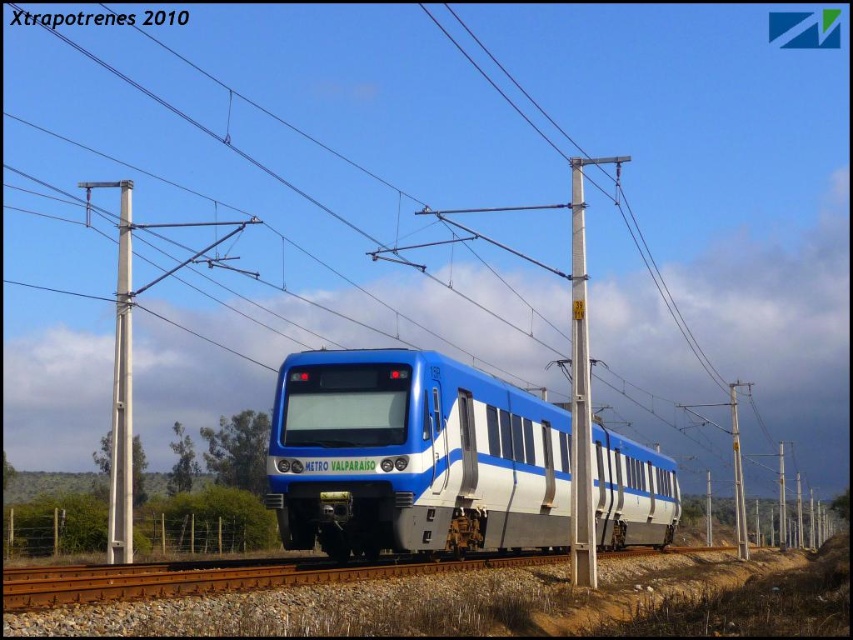
Question: Which object is farther from the camera taking this photo?

Choices:
 (A) white plastic pole at center
 (B) blue glossy train at center
 (C) metallic gray pole at center-right
 (D) white metallic pole at left

Answer: (A)

Question: Is metallic gray pole at center-right below white plastic pole at center?

Choices:
 (A) no
 (B) yes

Answer: (A)

Question: Which object is closer to the camera taking this photo?

Choices:
 (A) blue glossy train at center
 (B) metallic gray pole at center-right
 (C) white metallic pole at left
 (D) white plastic pole at center

Answer: (A)

Question: Is white metallic pole at left bigger than white plastic pole at center?

Choices:
 (A) yes
 (B) no

Answer: (A)

Question: Can you confirm if blue glossy train at center is positioned below white metallic pole at left?

Choices:
 (A) yes
 (B) no

Answer: (A)

Question: Which point is closer to the camera taking this photo?

Choices:
 (A) (442, 547)
 (B) (122, 188)
 (C) (577, 374)
 (D) (746, 548)

Answer: (A)